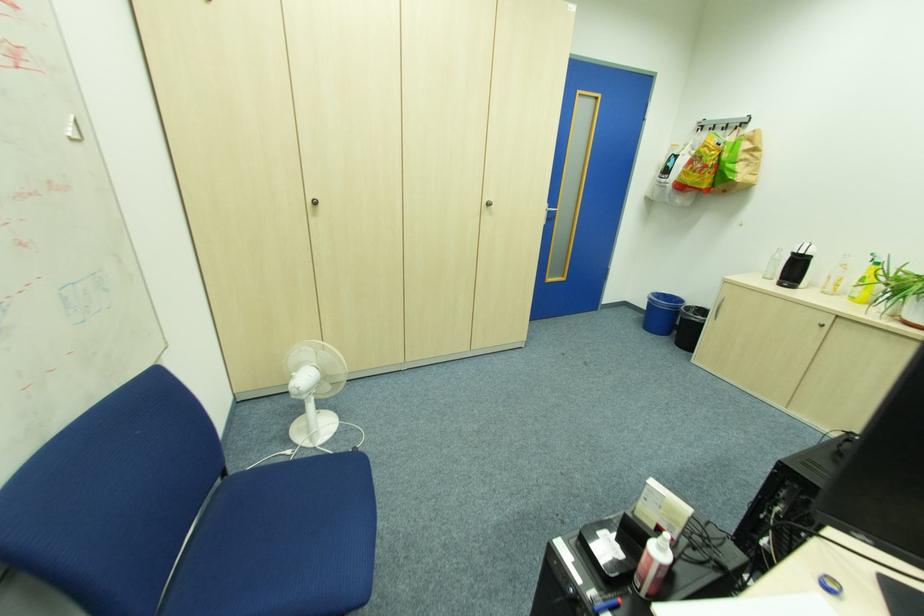
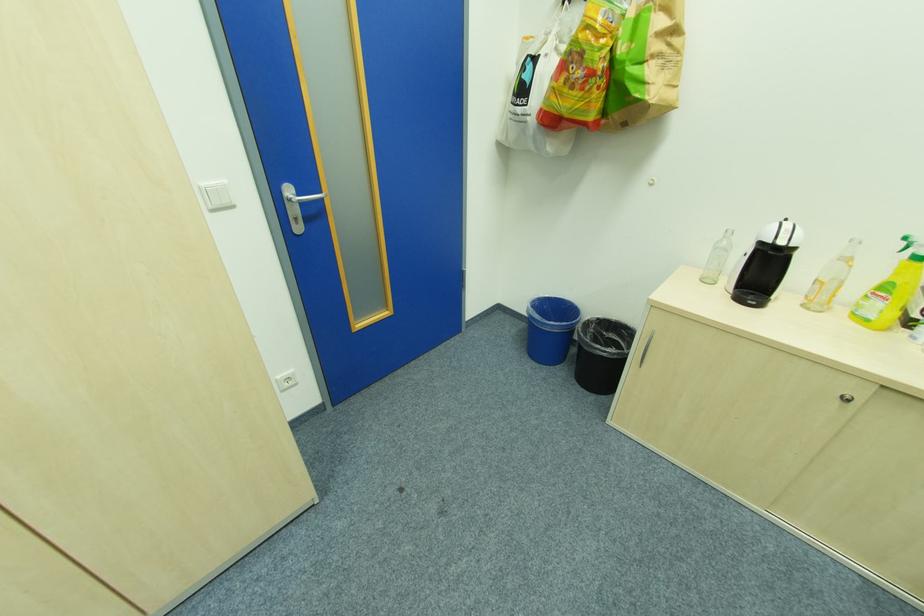
Find the pixel in the second image that matches point (879, 256) in the first image.

(909, 240)